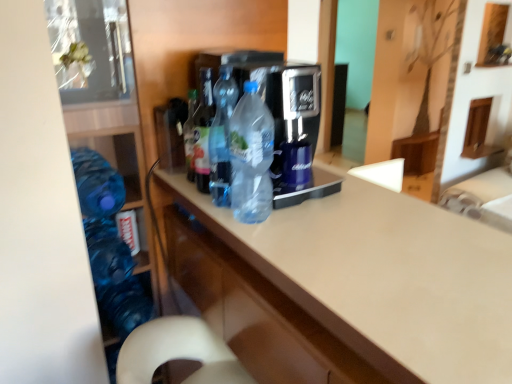
Find the location of a particular element. blue translucent bottle at lower left, which appears as the fourth bottle when viewed from the right is located at coordinates (97, 184).

What do you see at coordinates (384, 277) in the screenshot?
I see `beige laminate countertop at center` at bounding box center [384, 277].

What do you see at coordinates (251, 157) in the screenshot?
I see `translucent plastic bottle at center, placed as the first bottle when sorted from right to left` at bounding box center [251, 157].

In order to click on translucent plastic bottle at center, the 2th bottle when ordered from left to right in this screenshot , I will do `click(202, 132)`.

Is transparent plastic bottles at center situated inside translucent plastic bottle at center, arranged as the third bottle when viewed from the right, or outside?

transparent plastic bottles at center is outside translucent plastic bottle at center, arranged as the third bottle when viewed from the right.

Identify the location of appliance on the right of translucent plastic bottle at center, the 2th bottle when ordered from left to right. Image resolution: width=512 pixels, height=384 pixels. (275, 89).

From the picture: Which is farther, (276, 126) or (203, 72)?

The point (203, 72) is farther.

Between transparent plastic bottles at center and translucent plastic bottle at center, arranged as the third bottle when viewed from the right, which one is positioned in front?

Positioned in front is transparent plastic bottles at center.

Is translucent plastic bottle at center, which appears as the 4th bottle when viewed from the left, shorter than blue translucent bottle at lower left, arranged as the 1th bottle when viewed from the left?

No.

This screenshot has width=512, height=384. In order to click on the 3rd bottle to the left of the translucent plastic bottle at center, which appears as the 4th bottle when viewed from the left, counting from the anchor's position in this screenshot , I will do [97, 184].

Is there a large distance between translucent plastic bottle at center, placed as the first bottle when sorted from right to left, and blue translucent bottle at lower left, arranged as the 1th bottle when viewed from the left?

That's not correct — translucent plastic bottle at center, placed as the first bottle when sorted from right to left, is a little close to blue translucent bottle at lower left, arranged as the 1th bottle when viewed from the left.

Does translucent plastic bottle at center, placed as the first bottle when sorted from right to left, appear on the left side of blue translucent bottle at lower left, which appears as the fourth bottle when viewed from the right?

No.

Can blue translucent bottle at lower left, arranged as the 1th bottle when viewed from the left, be found inside beige laminate countertop at center?

No, blue translucent bottle at lower left, arranged as the 1th bottle when viewed from the left, is located outside of beige laminate countertop at center.

In the image, is beige laminate countertop at center on the left side or the right side of blue translucent bottle at lower left, which appears as the fourth bottle when viewed from the right?

From the image, it's evident that beige laminate countertop at center is to the right of blue translucent bottle at lower left, which appears as the fourth bottle when viewed from the right.

Which of these two, beige laminate countertop at center or blue translucent bottle at lower left, which appears as the fourth bottle when viewed from the right, stands taller?

beige laminate countertop at center is taller.

Which object is more forward, beige laminate countertop at center or blue translucent bottle at lower left, which appears as the fourth bottle when viewed from the right?

beige laminate countertop at center is in front.

Is transparent plastic bottles at center inside the boundaries of beige laminate countertop at center, or outside?

transparent plastic bottles at center is not inside beige laminate countertop at center, it's outside.

Looking at this image, from a real-world perspective, is transparent plastic bottles at center below beige laminate countertop at center?

No.

Is transparent plastic bottles at center wider than beige laminate countertop at center?

Incorrect, the width of transparent plastic bottles at center does not surpass that of beige laminate countertop at center.

From the image's perspective, does transparent plastic bottles at center appear lower than beige laminate countertop at center?

No, from the image's perspective, transparent plastic bottles at center is not below beige laminate countertop at center.

Considering the relative sizes of blue translucent bottle at lower left, which appears as the fourth bottle when viewed from the right, and transparent plastic bottles at center in the image provided, is blue translucent bottle at lower left, which appears as the fourth bottle when viewed from the right, bigger than transparent plastic bottles at center?

No.

Is blue translucent bottle at lower left, arranged as the 1th bottle when viewed from the left, far from transparent plastic bottles at center?

blue translucent bottle at lower left, arranged as the 1th bottle when viewed from the left, is actually quite close to transparent plastic bottles at center.

From the image's perspective, is blue translucent bottle at lower left, which appears as the fourth bottle when viewed from the right, positioned above or below transparent plastic bottles at center?

blue translucent bottle at lower left, which appears as the fourth bottle when viewed from the right, is situated lower than transparent plastic bottles at center in the image.

Considering the positions of objects blue translucent bottle at lower left, which appears as the fourth bottle when viewed from the right, and transparent plastic bottles at center in the image provided, who is more to the left, blue translucent bottle at lower left, which appears as the fourth bottle when viewed from the right, or transparent plastic bottles at center?

Positioned to the left is blue translucent bottle at lower left, which appears as the fourth bottle when viewed from the right.

From the picture: Does translucent plastic bottle at center, placed as the first bottle when sorted from right to left, have a lesser width compared to translucent plastic bottle at center, the third bottle when ordered from left to right?

No, translucent plastic bottle at center, placed as the first bottle when sorted from right to left, is not thinner than translucent plastic bottle at center, the third bottle when ordered from left to right.

Is there a large distance between translucent plastic bottle at center, which appears as the 4th bottle when viewed from the left, and translucent plastic bottle at center, the third bottle when ordered from left to right?

They are positioned close to each other.

In the scene shown: From a real-world perspective, which object stands above the other?

translucent plastic bottle at center, the 2th bottle viewed from the right.

Does translucent plastic bottle at center, which appears as the 4th bottle when viewed from the left, turn towards translucent plastic bottle at center, the third bottle when ordered from left to right?

Yes, translucent plastic bottle at center, which appears as the 4th bottle when viewed from the left, is oriented towards translucent plastic bottle at center, the third bottle when ordered from left to right.

Find the location of `bottle that is the 3rd object located above the beige laminate countertop at center (from the image's perspective)`. bottle that is the 3rd object located above the beige laminate countertop at center (from the image's perspective) is located at coordinates tap(221, 137).

Consider the image. Is beige laminate countertop at center not near translucent plastic bottle at center, the third bottle when ordered from left to right?

No, there isn't a large distance between beige laminate countertop at center and translucent plastic bottle at center, the third bottle when ordered from left to right.

Is beige laminate countertop at center positioned beyond the bounds of translucent plastic bottle at center, the third bottle when ordered from left to right?

beige laminate countertop at center lies outside translucent plastic bottle at center, the third bottle when ordered from left to right,'s area.

You are a GUI agent. You are given a task and a screenshot of the screen. Output one action in this format:
    pyautogui.click(x=<x>, y=<y>)
    Task: Click on the appliance in front of the translucent plastic bottle at center, the 2th bottle when ordered from left to right
    This screenshot has width=512, height=384.
    Given the screenshot: What is the action you would take?
    pyautogui.click(x=275, y=89)

You are a GUI agent. You are given a task and a screenshot of the screen. Output one action in this format:
    pyautogui.click(x=<x>, y=<y>)
    Task: Click on the 2nd bottle positioned above the blue translucent bottle at lower left, arranged as the 1th bottle when viewed from the left (from a real-world perspective)
    The width and height of the screenshot is (512, 384).
    Given the screenshot: What is the action you would take?
    pyautogui.click(x=251, y=157)

Estimate the real-world distances between objects in this image. Which object is further from beige laminate countertop at center, transparent plastic bottles at center or translucent plastic bottle at center, the 2th bottle when ordered from left to right?

The object further to beige laminate countertop at center is translucent plastic bottle at center, the 2th bottle when ordered from left to right.

From the image, which object appears to be nearer to blue translucent bottle at lower left, which appears as the fourth bottle when viewed from the right, translucent plastic bottle at center, placed as the first bottle when sorted from right to left, or transparent plastic bottles at center?

translucent plastic bottle at center, placed as the first bottle when sorted from right to left, lies closer to blue translucent bottle at lower left, which appears as the fourth bottle when viewed from the right, than the other object.

Based on their spatial positions, is translucent plastic bottle at center, arranged as the third bottle when viewed from the right, or translucent plastic bottle at center, the third bottle when ordered from left to right, further from translucent plastic bottle at center, placed as the first bottle when sorted from right to left?

translucent plastic bottle at center, arranged as the third bottle when viewed from the right, is further to translucent plastic bottle at center, placed as the first bottle when sorted from right to left.

From the image, which object appears to be nearer to transparent plastic bottles at center, beige laminate countertop at center or translucent plastic bottle at center, the 2th bottle viewed from the right?

translucent plastic bottle at center, the 2th bottle viewed from the right.

From the image, which object appears to be nearer to blue translucent bottle at lower left, arranged as the 1th bottle when viewed from the left, beige laminate countertop at center or translucent plastic bottle at center, the 2th bottle viewed from the right?

Based on the image, translucent plastic bottle at center, the 2th bottle viewed from the right, appears to be nearer to blue translucent bottle at lower left, arranged as the 1th bottle when viewed from the left.

Considering their positions, is translucent plastic bottle at center, arranged as the third bottle when viewed from the right, positioned closer to beige laminate countertop at center than blue translucent bottle at lower left, arranged as the 1th bottle when viewed from the left?

translucent plastic bottle at center, arranged as the third bottle when viewed from the right, lies closer to beige laminate countertop at center than the other object.

Estimate the real-world distances between objects in this image. Which object is closer to translucent plastic bottle at center, placed as the first bottle when sorted from right to left, beige laminate countertop at center or blue translucent bottle at lower left, arranged as the 1th bottle when viewed from the left?

beige laminate countertop at center lies closer to translucent plastic bottle at center, placed as the first bottle when sorted from right to left, than the other object.

When comparing their distances from translucent plastic bottle at center, which appears as the 4th bottle when viewed from the left, does beige laminate countertop at center or transparent plastic bottles at center seem closer?

transparent plastic bottles at center lies closer to translucent plastic bottle at center, which appears as the 4th bottle when viewed from the left, than the other object.

Find the location of a particular element. bottle situated between blue translucent bottle at lower left, arranged as the 1th bottle when viewed from the left, and translucent plastic bottle at center, the 2th bottle viewed from the right, from left to right is located at coordinates (202, 132).

The height and width of the screenshot is (384, 512). I want to click on bottle between translucent plastic bottle at center, placed as the first bottle when sorted from right to left, and beige laminate countertop at center, in the vertical direction, so click(97, 184).